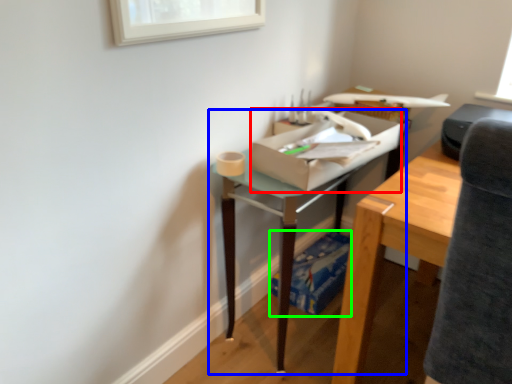
Question: Which object is the closest to the cardboard box (highlighted by a red box)? Choose among these: table (highlighted by a blue box) or cardboard box (highlighted by a green box).

Choices:
 (A) table
 (B) cardboard box

Answer: (A)